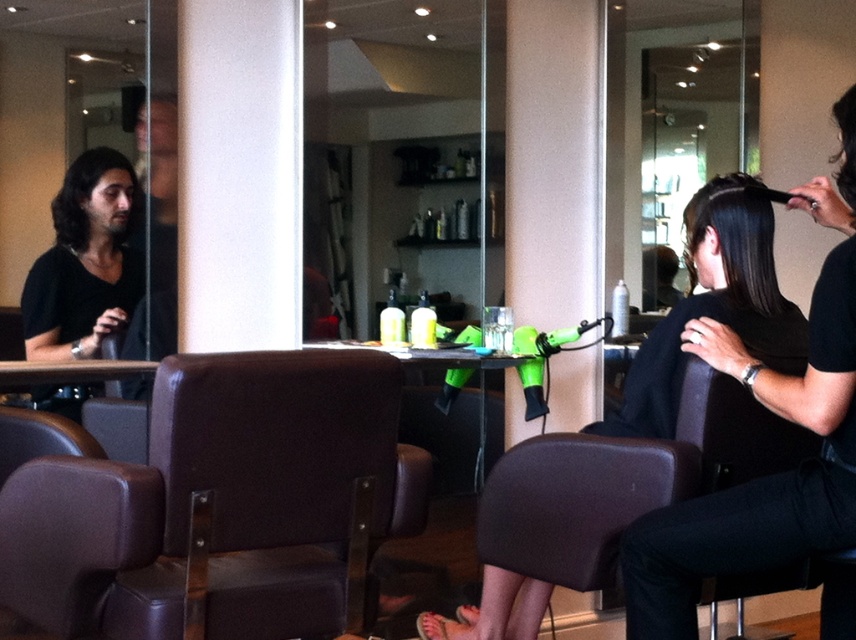
You are a customer in the salon and want to choose between two hairstyles shown in the image. The stylist offers you the smooth dark brown hair at center and the dark brown wavy hair at left. Based on their positions in the image, which hairstyle is closer to the mirror?

The dark brown wavy hair at left is closer to the mirror because the smooth dark brown hair at center is positioned on the right side of it, meaning the wavy hair is to the left and thus closer to the mirror located in the background to the left.

You are a customer entering the hair salon and want to sit in the brown leather chair at center. However, you notice a dark brown wavy hair at left near the chair. Can you sit down without bending over?

The brown leather chair at center is taller than the dark brown wavy hair at left, so you can sit down without bending over because the chair is higher than the hair.